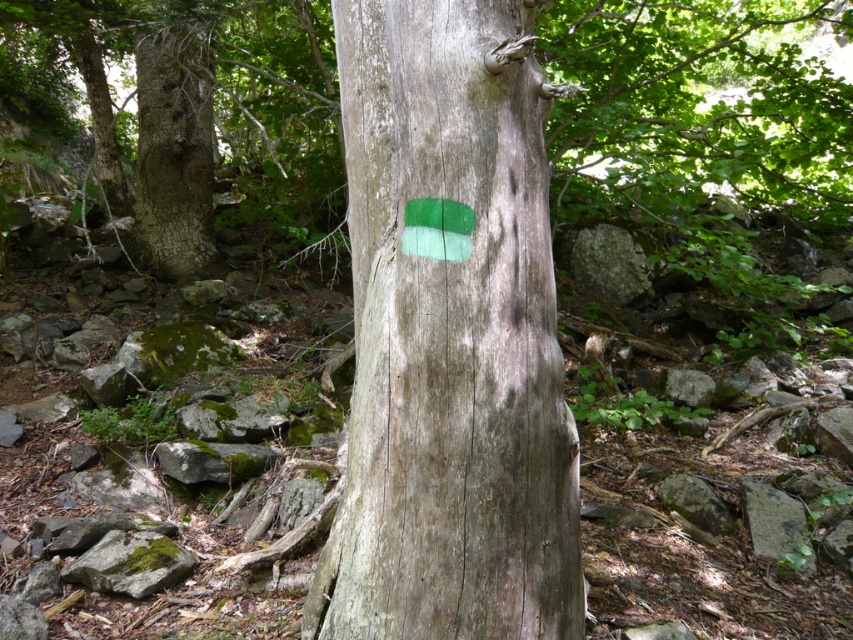
Question: Can you confirm if green matte paint at center is positioned below green mossy rock at lower left?

Choices:
 (A) yes
 (B) no

Answer: (B)

Question: Observing the image, what is the correct spatial positioning of green matte paint at center in reference to green painted wood at center?

Choices:
 (A) left
 (B) right

Answer: (B)

Question: Among these objects, which one is nearest to the camera?

Choices:
 (A) green painted wood at center
 (B) green mossy rock at lower left

Answer: (B)

Question: Observing the image, what is the correct spatial positioning of green matte paint at center in reference to green mossy rock at lower left?

Choices:
 (A) right
 (B) left

Answer: (A)

Question: Estimate the real-world distances between objects in this image. Which object is closer to the green matte paint at center?

Choices:
 (A) green painted wood at center
 (B) green mossy rock at lower left

Answer: (B)

Question: Based on their relative distances, which object is farther from the green mossy rock at lower left?

Choices:
 (A) green painted wood at center
 (B) green matte paint at center

Answer: (A)